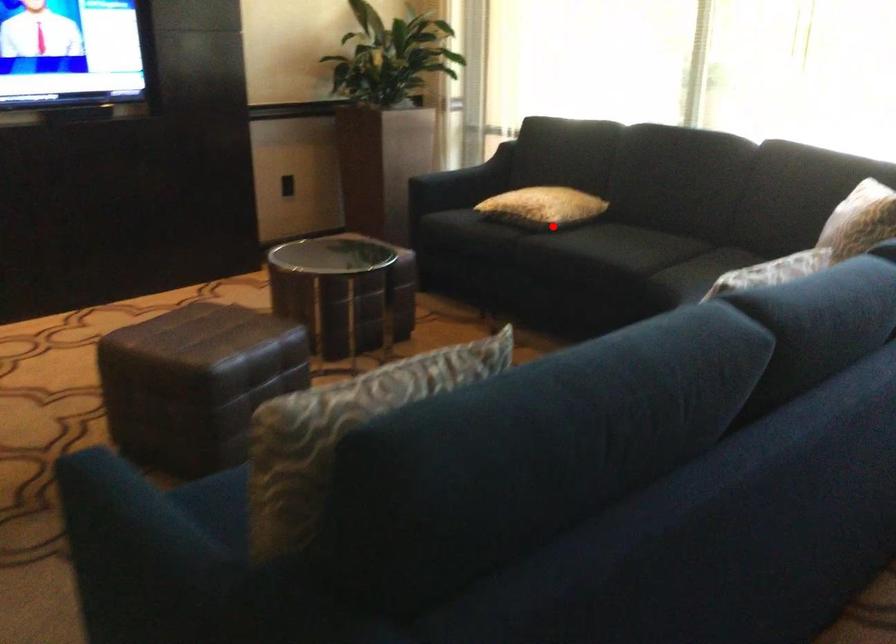
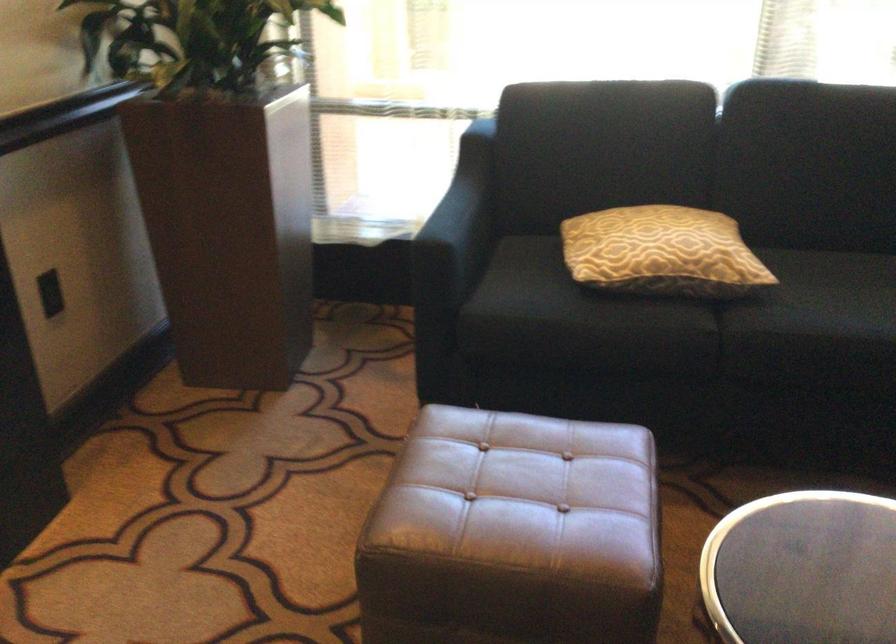
Locate, in the second image, the point that corresponds to the highlighted location in the first image.

(752, 289)